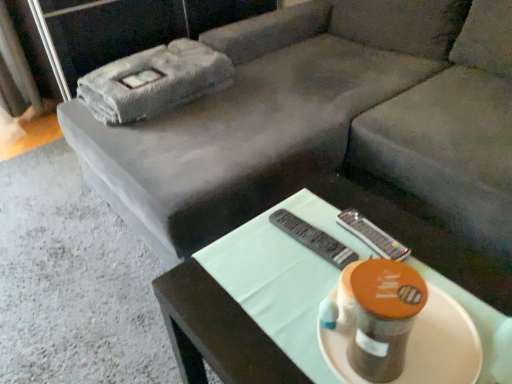
Where is `free space in front of black plastic remote at center`? free space in front of black plastic remote at center is located at coordinates pos(284,297).